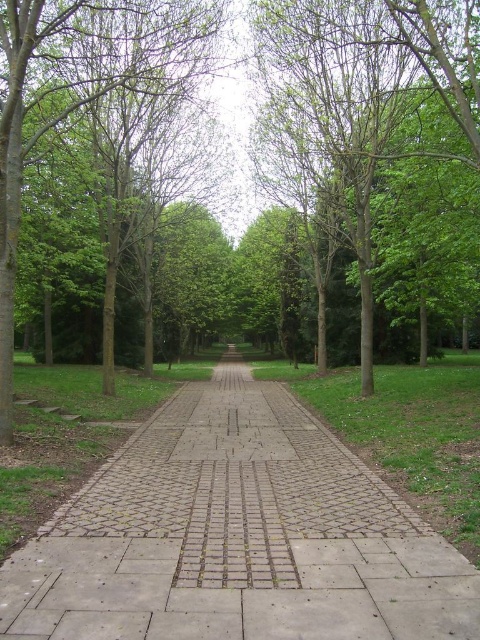
You are a gardener walking along the pathway in the park. You want to reach the green grass at center to water it. However, there is a green leafy tree at left in your way. Can you walk around the tree to get to the grass?

The green grass at center is behind the green leafy tree at left, so you can walk around the tree to reach the green grass at center.

You are a park visitor walking along the pathway and want to find the taller tree between the green leafy tree at center and the green leafy tree at left. Which one should you look towards?

The green leafy tree at left is taller than the green leafy tree at center, so you should look towards the green leafy tree at left.